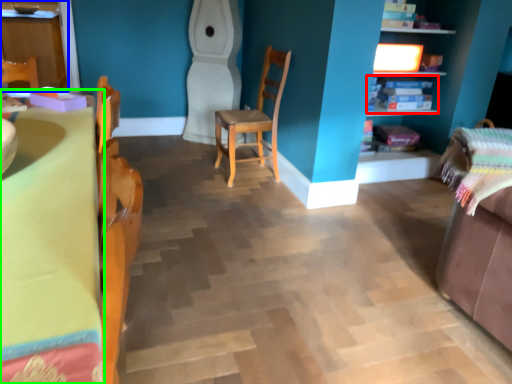
Question: Which object is the farthest from shelf (highlighted by a red box)? Choose among these: cabinetry (highlighted by a blue box) or table (highlighted by a green box).

Choices:
 (A) cabinetry
 (B) table

Answer: (A)